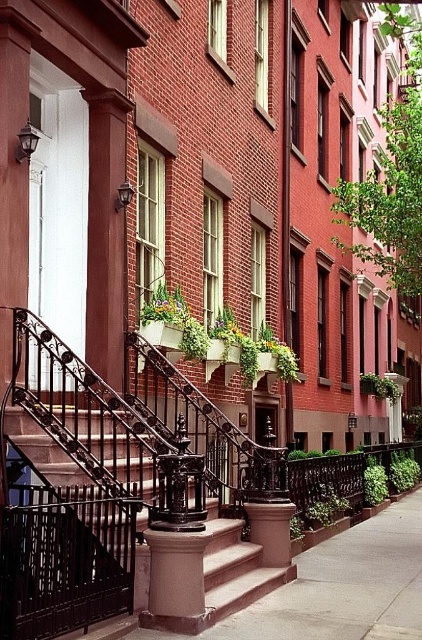
Question: Can you confirm if smooth concrete steps at center is bigger than polished bronze staircase at center?

Choices:
 (A) yes
 (B) no

Answer: (A)

Question: Does smooth concrete steps at center appear under polished bronze staircase at center?

Choices:
 (A) yes
 (B) no

Answer: (A)

Question: Which of the following is the closest to the observer?

Choices:
 (A) smooth concrete steps at center
 (B) polished bronze staircase at center

Answer: (A)

Question: Can you confirm if smooth concrete steps at center is bigger than polished bronze staircase at center?

Choices:
 (A) yes
 (B) no

Answer: (A)

Question: Which object is farther from the camera taking this photo?

Choices:
 (A) polished bronze staircase at center
 (B) smooth concrete steps at center

Answer: (A)

Question: Among these points, which one is farthest from the camera?

Choices:
 (A) (278, 637)
 (B) (230, 611)

Answer: (B)